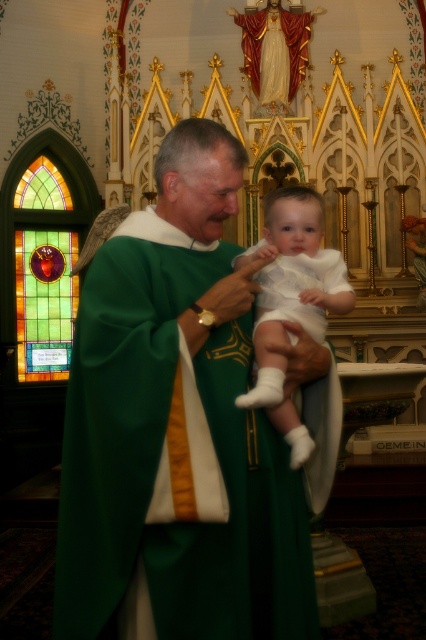
Question: Considering the relative positions of green satin robe at center and white smooth fabric baby at center in the image provided, where is green satin robe at center located with respect to white smooth fabric baby at center?

Choices:
 (A) below
 (B) above

Answer: (A)

Question: Which object is positioned closest to the stained glass window at left?

Choices:
 (A) green satin robe at center
 (B) white smooth fabric baby at center

Answer: (B)

Question: Which point is closer to the camera taking this photo?

Choices:
 (A) (279, 474)
 (B) (16, 275)

Answer: (A)

Question: Which of the following is the farthest from the observer?

Choices:
 (A) stained glass window at left
 (B) white smooth fabric baby at center
 (C) green satin robe at center

Answer: (A)

Question: Is green satin robe at center below stained glass window at left?

Choices:
 (A) yes
 (B) no

Answer: (A)

Question: Does green satin robe at center lie behind stained glass window at left?

Choices:
 (A) yes
 (B) no

Answer: (B)